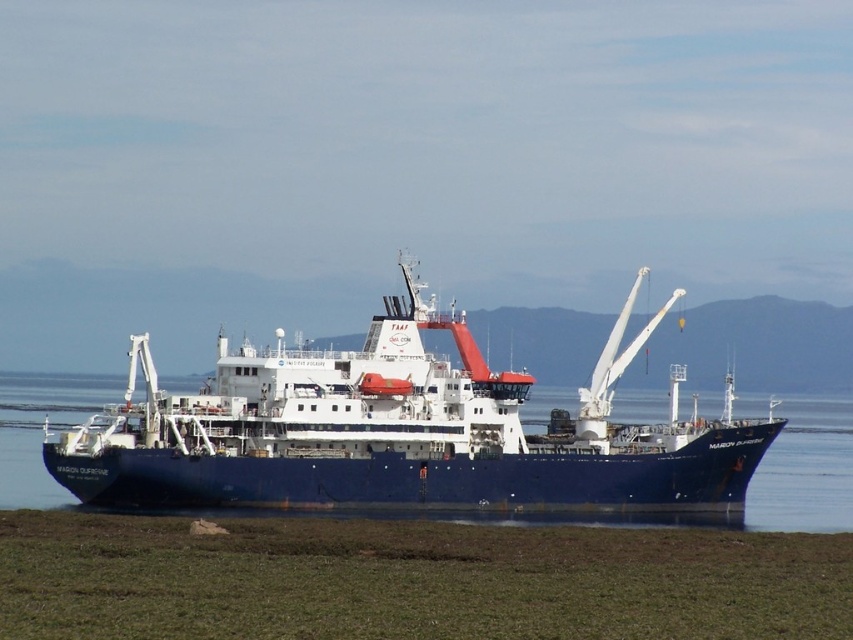
Question: Does blue matte ship at center have a larger size compared to blue glossy water at center?

Choices:
 (A) yes
 (B) no

Answer: (A)

Question: Which point is farther from the camera taking this photo?

Choices:
 (A) (550, 477)
 (B) (50, 506)

Answer: (B)

Question: Is blue matte ship at center below blue glossy water at center?

Choices:
 (A) yes
 (B) no

Answer: (B)

Question: Is blue matte ship at center positioned behind blue glossy water at center?

Choices:
 (A) no
 (B) yes

Answer: (A)